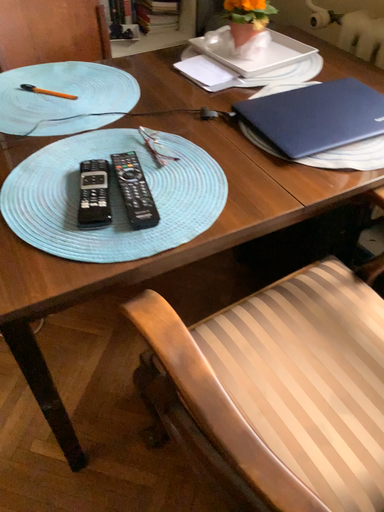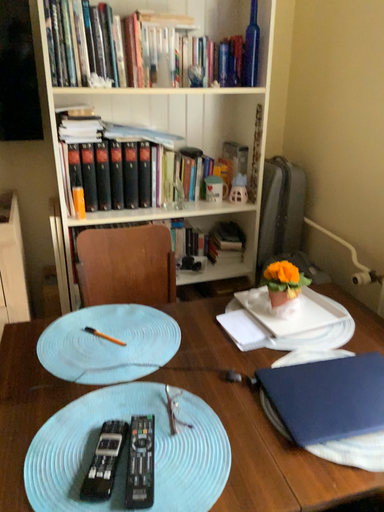
Question: Which way did the camera rotate in the video?

Choices:
 (A) rotated right
 (B) rotated left

Answer: (B)